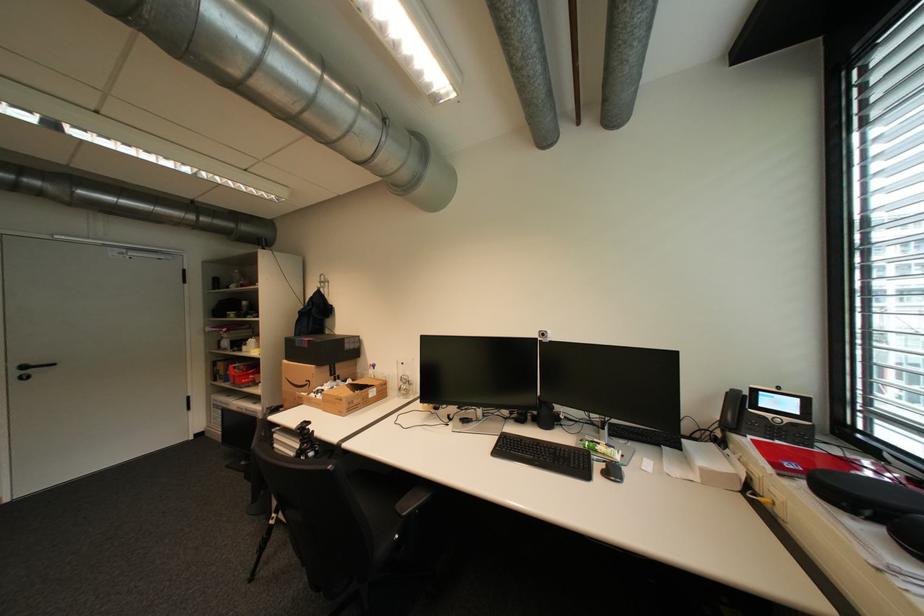
What do you see at coordinates (322, 349) in the screenshot?
I see `the black box` at bounding box center [322, 349].